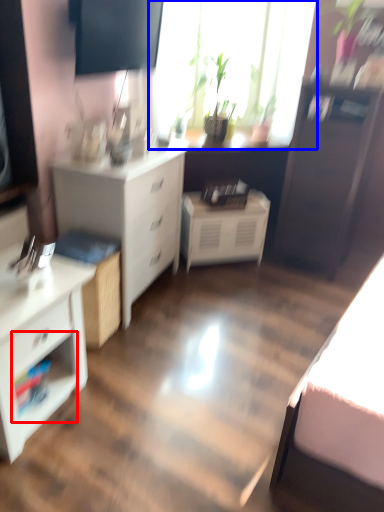
Question: Which point is closer to the camera, shelf (highlighted by a red box) or window (highlighted by a blue box)?

Choices:
 (A) shelf
 (B) window

Answer: (A)